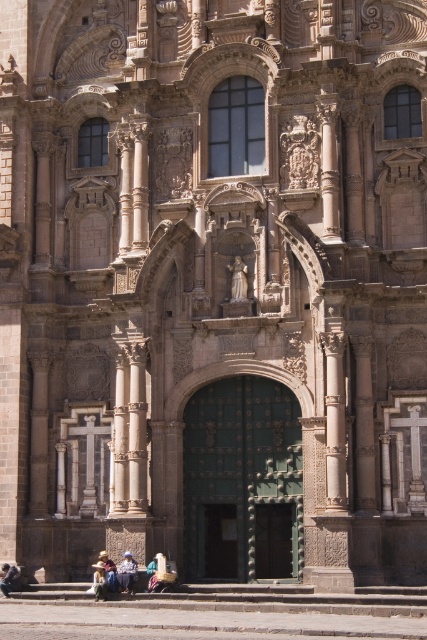
You are standing at the entrance of the historic building and want to reach the stone steps at center. Based on the 2D coordinates provided, in which direction should you move relative to your current position?

The stone steps at center are located at coordinates point (280, 600). Since you are at the entrance, you should move forward towards the center of the building to reach them.

You are a security guard at the historic building and need to check if an object is blocking the entrance. You see the light brown leather jacket at lower center and the blue denim jeans at lower center. Which object is wider?

The light brown leather jacket at lower center might be wider than the blue denim jeans at lower center according to the description.